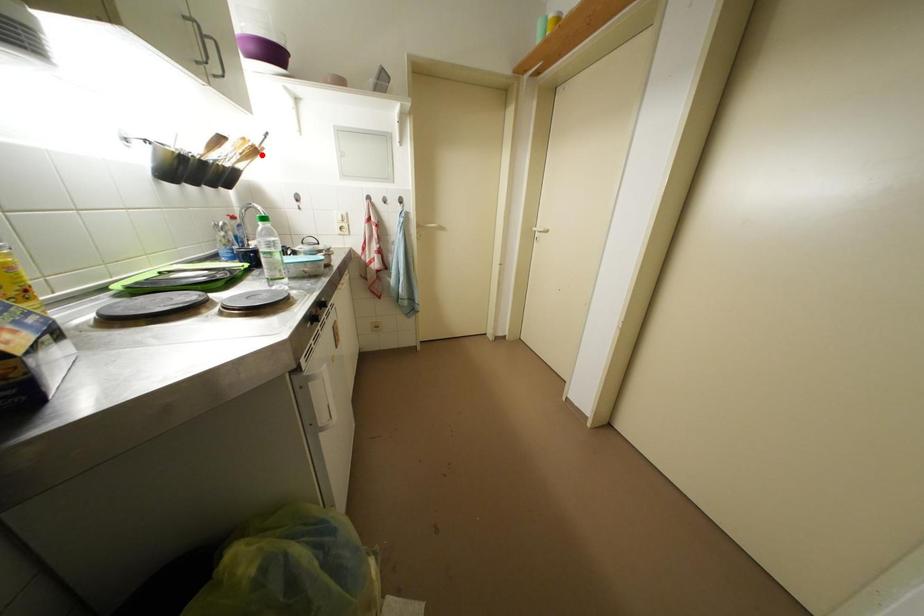
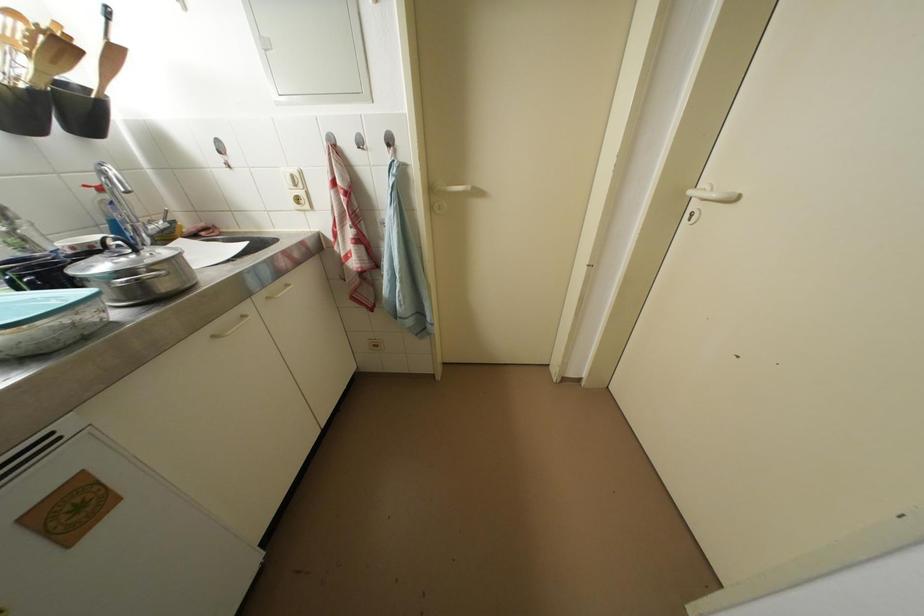
In the second image, find the point that corresponds to the highlighted location in the first image.

(69, 50)